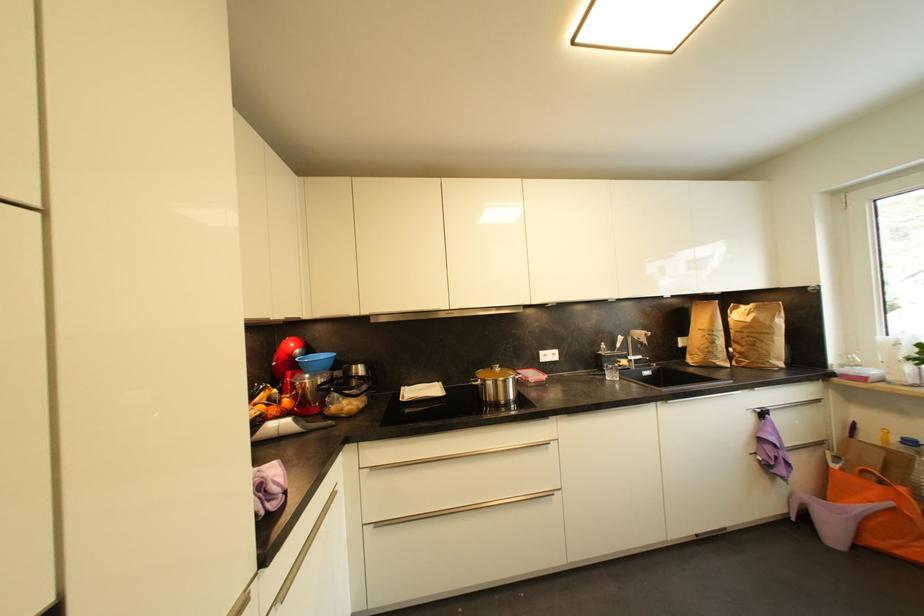
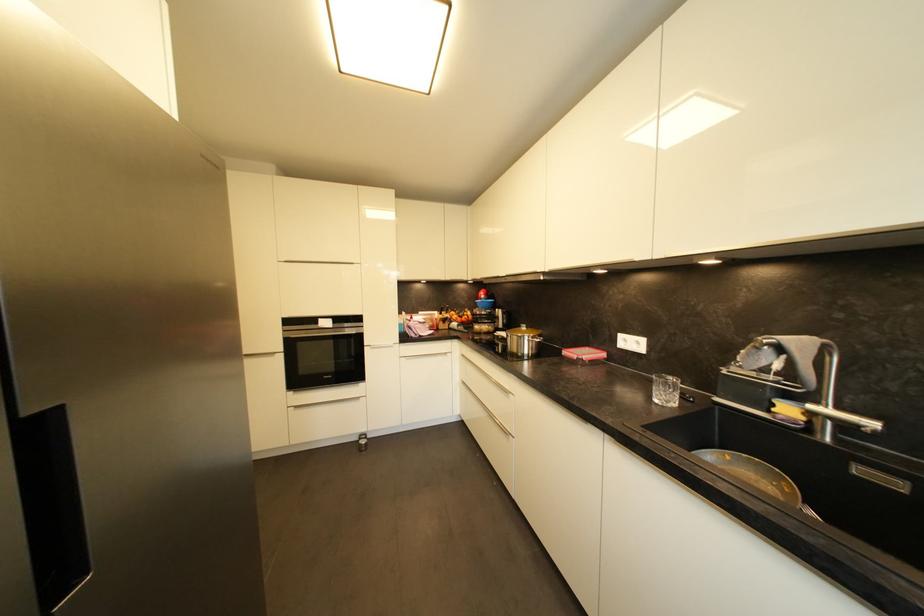
The point at [652,375] is marked in the first image. Where is the corresponding point in the second image?

(904, 487)